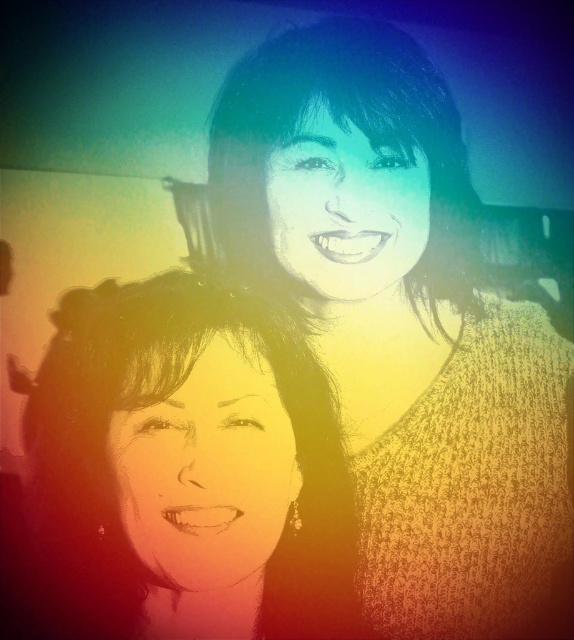
You are a photographer adjusting your camera settings. You notice two points in the frame at coordinates point (375, 192) and point (305, 129). Which point is closer to your camera lens?

Point (375, 192) is further to the camera than point (305, 129), so the point closer to the camera lens is point (305, 129).

You are a photographer adjusting the lighting setup for a portrait session. You notice the knitted sweater at upper right and smooth black hair at upper center in the frame. Which object is positioned to the right side of the other?

The knitted sweater at upper right is positioned to the right of smooth black hair at upper center.